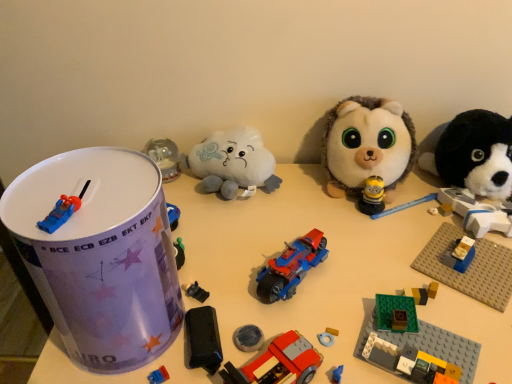
Find the location of `free space between fluffy white plush at center, the 8th toy when ordered from left to right, and green plastic building block at lower right, the third toy from the right`. free space between fluffy white plush at center, the 8th toy when ordered from left to right, and green plastic building block at lower right, the third toy from the right is located at coordinates (385, 254).